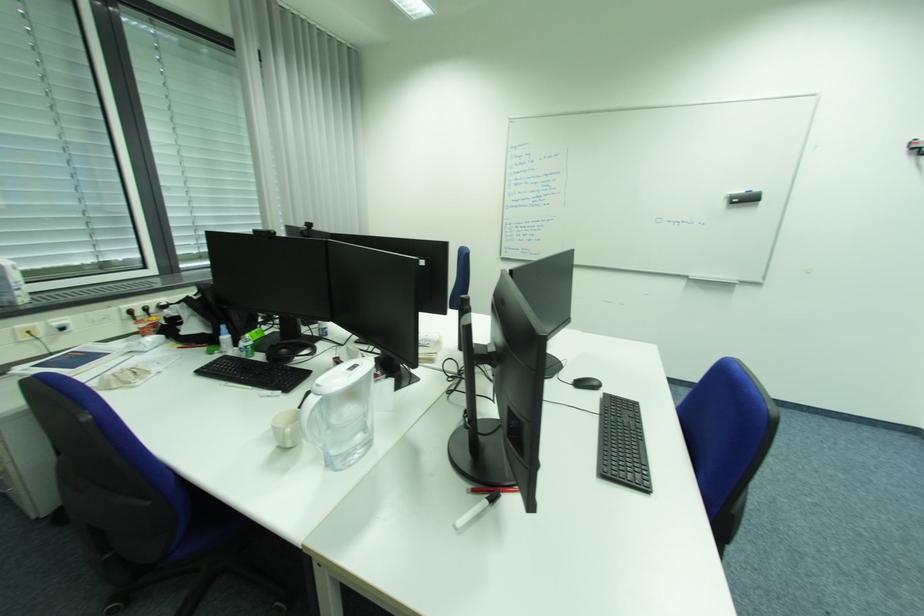
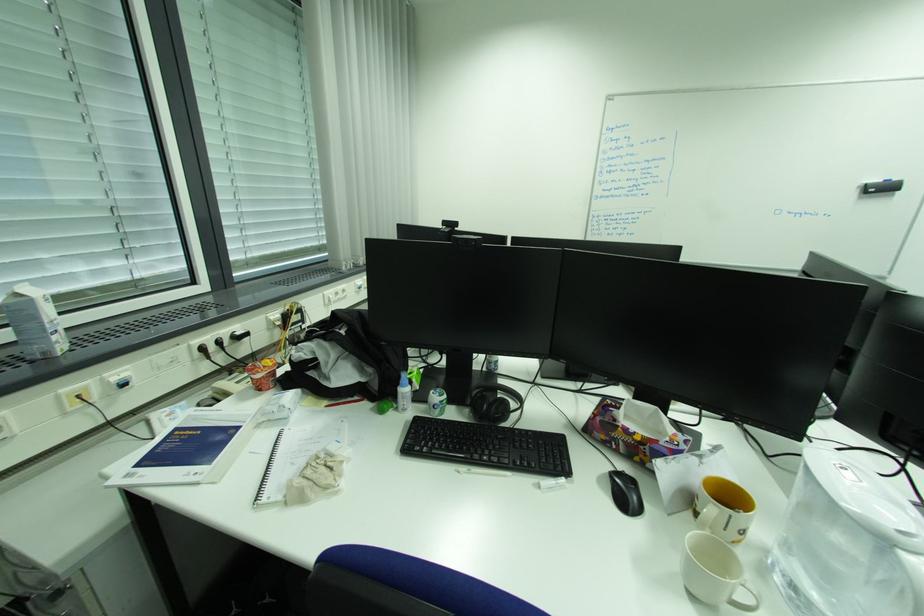
Which direction would the cameraman need to move to produce the second image?

The movement direction of the cameraman is left, forward.